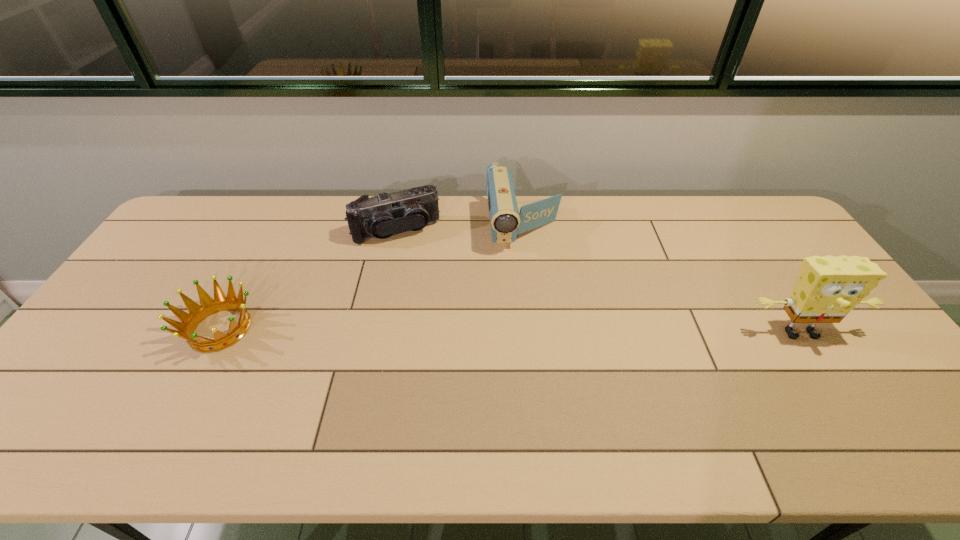
Image resolution: width=960 pixels, height=540 pixels. I want to click on the leftmost object, so click(x=208, y=306).

I want to click on the shortest object, so click(x=208, y=306).

Find the location of a particular element. sponge is located at coordinates (828, 288).

Image resolution: width=960 pixels, height=540 pixels. I want to click on the tallest object, so click(828, 288).

At what (x,y) coordinates should I click in order to perform the action: click on the third object from left to right. Please return your answer as a coordinate pair (x, y). The width and height of the screenshot is (960, 540). Looking at the image, I should click on (506, 222).

What are the coordinates of `the second tallest object` in the screenshot? It's located at (506, 222).

Where is `the left camcorder`? This screenshot has height=540, width=960. the left camcorder is located at coordinates (381, 216).

Identify the location of the second object from left to right. The width and height of the screenshot is (960, 540). (381, 216).

Where is `blank area located on the left of the shortest object`? The width and height of the screenshot is (960, 540). blank area located on the left of the shortest object is located at coordinates (110, 329).

This screenshot has width=960, height=540. Identify the location of free space located on the face of the tallest object. (842, 398).